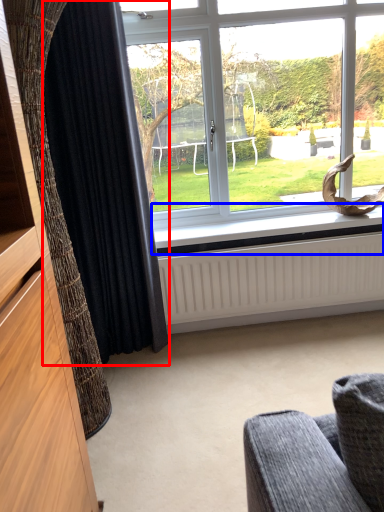
Question: Among these objects, which one is farthest to the camera, curtain (highlighted by a red box) or window sill (highlighted by a blue box)?

Choices:
 (A) curtain
 (B) window sill

Answer: (B)